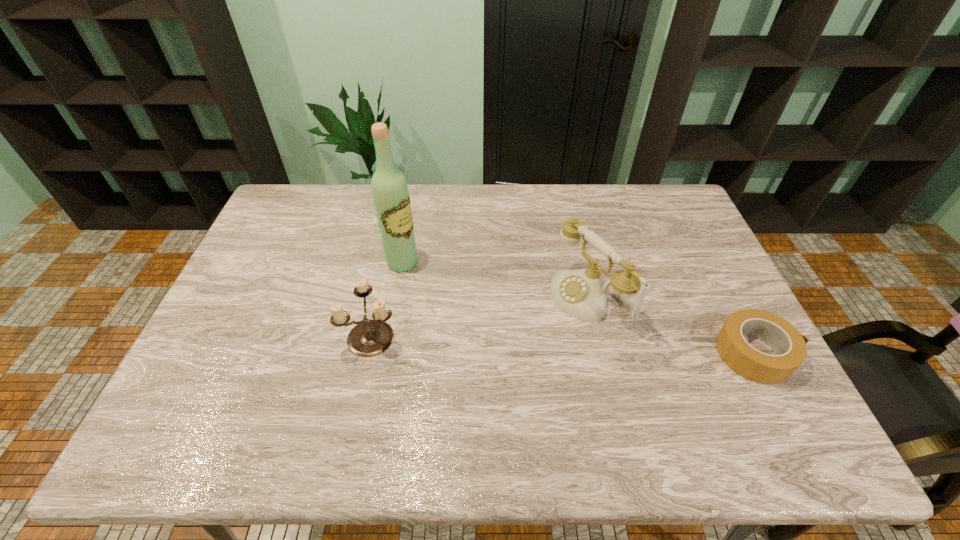
Locate an element on the screen. This screenshot has width=960, height=540. object that is the third closest to the rightmost object is located at coordinates (390, 192).

Image resolution: width=960 pixels, height=540 pixels. In order to click on vacant point that satisfies the following two spatial constraints: 1. on the front side of the second object from right to left; 2. at the edge of the shortest object in this screenshot , I will do `click(603, 353)`.

At what (x,y) coordinates should I click in order to perform the action: click on free spot that satisfies the following two spatial constraints: 1. on the front side of the shortest object; 2. at the edge of the candle holder. Please return your answer as a coordinate pair (x, y). Looking at the image, I should click on click(369, 353).

The height and width of the screenshot is (540, 960). In order to click on vacant space that satisfies the following two spatial constraints: 1. on the front side of the tallest object; 2. at the edge of the rightmost object in this screenshot , I will do `click(387, 353)`.

Image resolution: width=960 pixels, height=540 pixels. I want to click on vacant position in the image that satisfies the following two spatial constraints: 1. on the back side of the telephone; 2. on the left side of the candle holder, so click(380, 297).

Image resolution: width=960 pixels, height=540 pixels. In order to click on vacant point that satisfies the following two spatial constraints: 1. on the front side of the candle holder; 2. at the edge of the duct tape in this screenshot , I will do `click(369, 353)`.

At what (x,y) coordinates should I click in order to perform the action: click on vacant space that satisfies the following two spatial constraints: 1. on the front side of the wine bottle; 2. at the edge of the duct tape. Please return your answer as a coordinate pair (x, y). Image resolution: width=960 pixels, height=540 pixels. Looking at the image, I should click on (387, 353).

Locate an element on the screen. vacant area in the image that satisfies the following two spatial constraints: 1. on the back side of the candle holder; 2. on the left side of the tallest object is located at coordinates (388, 262).